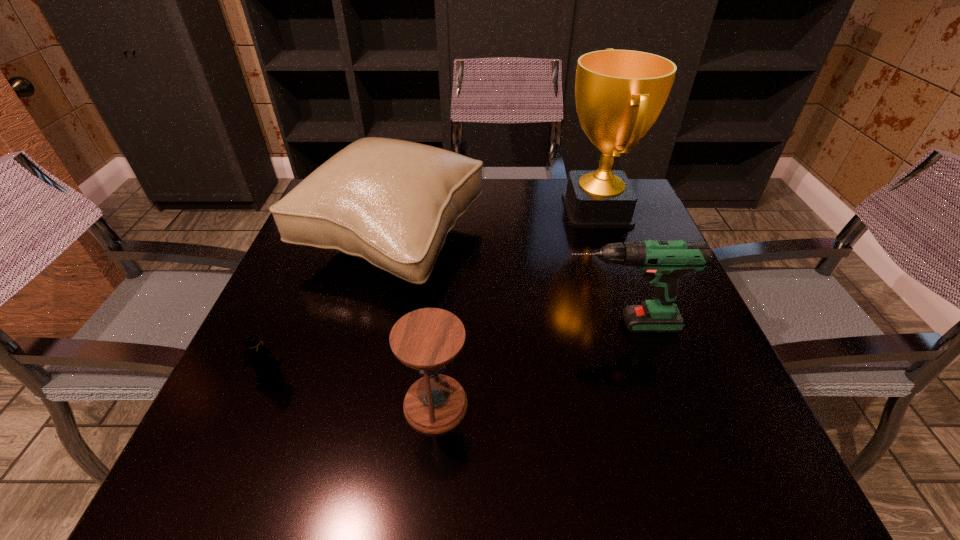
What are the coordinates of `vacant region located 0.310m on the handle side of the third farthest object` in the screenshot? It's located at (406, 325).

Locate an element on the screen. Image resolution: width=960 pixels, height=540 pixels. free space located on the handle side of the third farthest object is located at coordinates (535, 325).

The width and height of the screenshot is (960, 540). I want to click on vacant area located 0.280m on the back of the hourglass, so click(446, 275).

Where is `free space located on the face of the shortest object`? free space located on the face of the shortest object is located at coordinates (257, 407).

Identify the location of award at the far edge. The width and height of the screenshot is (960, 540). (619, 94).

This screenshot has width=960, height=540. In order to click on cushion that is at the far edge in this screenshot , I will do `click(391, 202)`.

You are a GUI agent. You are given a task and a screenshot of the screen. Output one action in this format:
    pyautogui.click(x=<x>, y=<y>)
    Task: Click on the cushion located at the left edge
    The width and height of the screenshot is (960, 540).
    Given the screenshot: What is the action you would take?
    pyautogui.click(x=391, y=202)

You are a GUI agent. You are given a task and a screenshot of the screen. Output one action in this format:
    pyautogui.click(x=<x>, y=<y>)
    Task: Click on the Lego situated at the left edge
    This screenshot has width=960, height=540.
    Given the screenshot: What is the action you would take?
    tap(265, 363)

You are a GUI agent. You are given a task and a screenshot of the screen. Output one action in this format:
    pyautogui.click(x=<x>, y=<y>)
    Task: Click on the award that is at the right edge
    Image resolution: width=960 pixels, height=540 pixels.
    Given the screenshot: What is the action you would take?
    pyautogui.click(x=619, y=94)

Find the location of `drill that is at the right edge`. drill that is at the right edge is located at coordinates (662, 262).